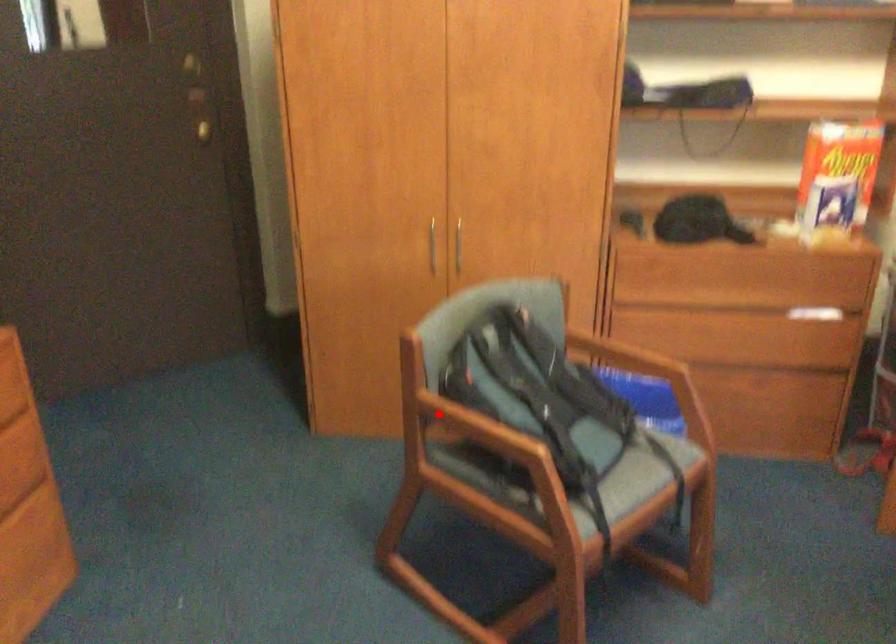
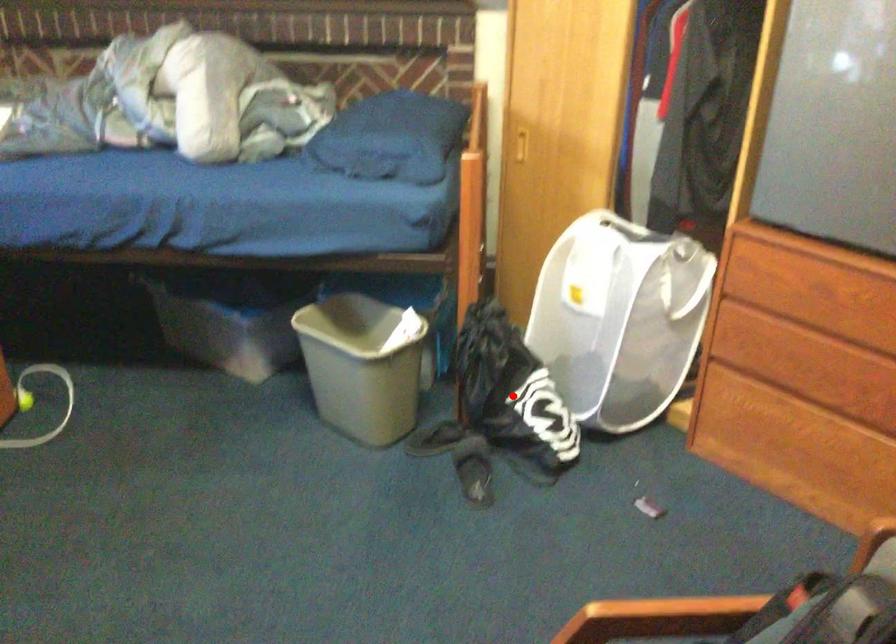
I am providing you with two images of the same scene from different viewpoints. A red point is marked on the first image and another point is marked on the second image. Is the red point in image1 aligned with the point shown in image2?

No